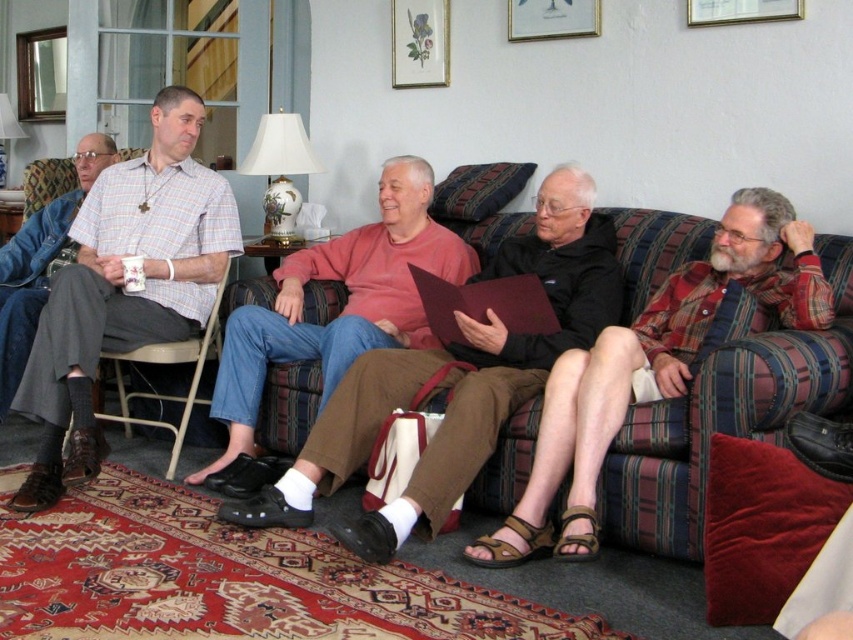
Question: Considering the relative positions of plaid shirt at left and matte plaid shirt at left in the image provided, where is plaid shirt at left located with respect to matte plaid shirt at left?

Choices:
 (A) left
 (B) right

Answer: (B)

Question: Which of these objects is positioned closest to the matte plaid shirt at left?

Choices:
 (A) plaid shirt at left
 (B) matte red sweater at center
 (C) metallic gray chair at left
 (D) gold-framed picture at upper center

Answer: (A)

Question: Among these points, which one is nearest to the camera?

Choices:
 (A) (604, 252)
 (B) (595, 442)

Answer: (B)

Question: Which of these objects is positioned closest to the matte red sweater at center?

Choices:
 (A) wooden picture frame at upper center
 (B) matte glass picture frame at upper center
 (C) metallic gray chair at left
 (D) matte plaid shirt at left

Answer: (C)

Question: Is the position of plaid shirt at left less distant than that of metallic gray chair at left?

Choices:
 (A) yes
 (B) no

Answer: (A)

Question: Is metallic gray chair at left smaller than wooden picture frame at upper center?

Choices:
 (A) yes
 (B) no

Answer: (B)